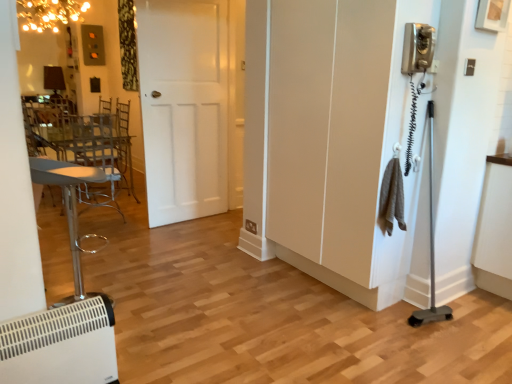
This screenshot has height=384, width=512. In order to click on vacant area that lies to the right of white plastic heater at lower left in this screenshot , I will do `click(144, 312)`.